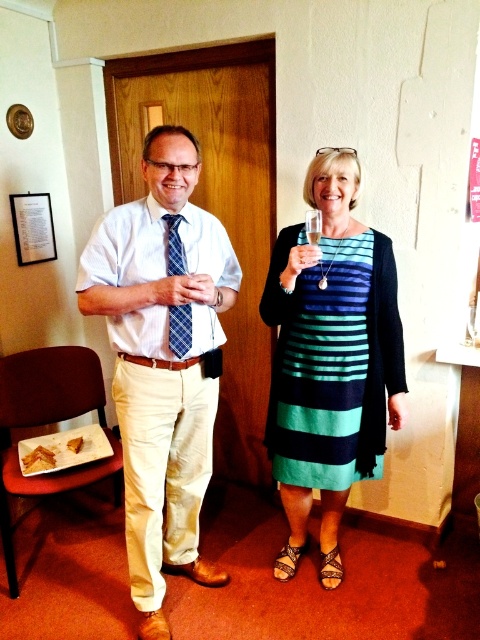
Question: Which point is closer to the camera taking this photo?

Choices:
 (A) (213, 348)
 (B) (345, 436)

Answer: (A)

Question: Can you confirm if matte blue tie at center is positioned above teal striped dress at center?

Choices:
 (A) yes
 (B) no

Answer: (A)

Question: Can you confirm if matte blue tie at center is positioned above teal striped dress at center?

Choices:
 (A) no
 (B) yes

Answer: (B)

Question: Considering the relative positions of matte blue tie at center and teal striped dress at center in the image provided, where is matte blue tie at center located with respect to teal striped dress at center?

Choices:
 (A) below
 (B) above

Answer: (B)